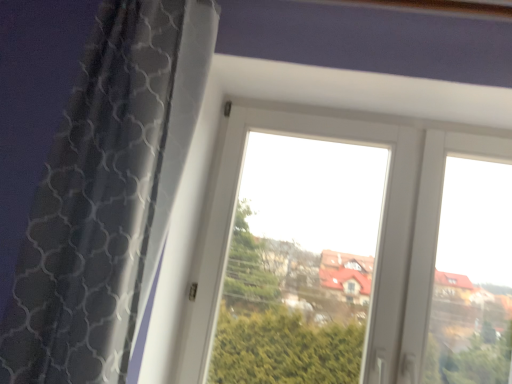
Question: Considering the positions of point tap(202, 8) and point tap(420, 165), is point tap(202, 8) closer or farther from the camera than point tap(420, 165)?

Choices:
 (A) closer
 (B) farther

Answer: (A)

Question: Would you say black mesh curtain at left is to the left or to the right of transparent glass window at center in the picture?

Choices:
 (A) right
 (B) left

Answer: (B)

Question: From the image's perspective, relative to transparent glass window at center, is black mesh curtain at left above or below?

Choices:
 (A) above
 (B) below

Answer: (A)

Question: Is point (401, 377) positioned closer to the camera than point (122, 349)?

Choices:
 (A) farther
 (B) closer

Answer: (A)

Question: Choose the correct answer: Is transparent glass window at center inside black mesh curtain at left or outside it?

Choices:
 (A) outside
 (B) inside

Answer: (A)

Question: From their relative heights in the image, would you say transparent glass window at center is taller or shorter than black mesh curtain at left?

Choices:
 (A) tall
 (B) short

Answer: (B)

Question: In the image, is transparent glass window at center on the left side or the right side of black mesh curtain at left?

Choices:
 (A) left
 (B) right

Answer: (B)